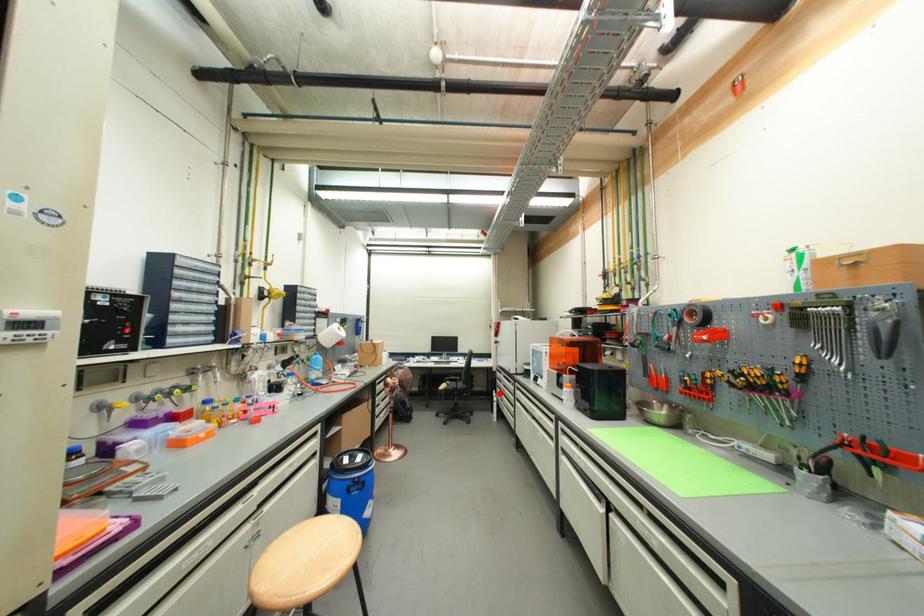
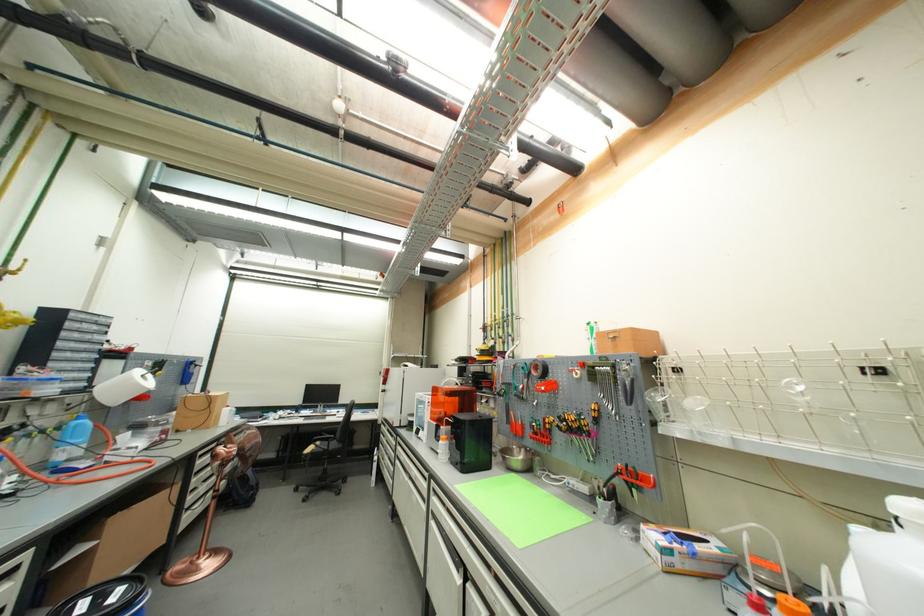
Locate, in the second image, the point that corresponds to the highlighted location in the first image.

(382, 450)